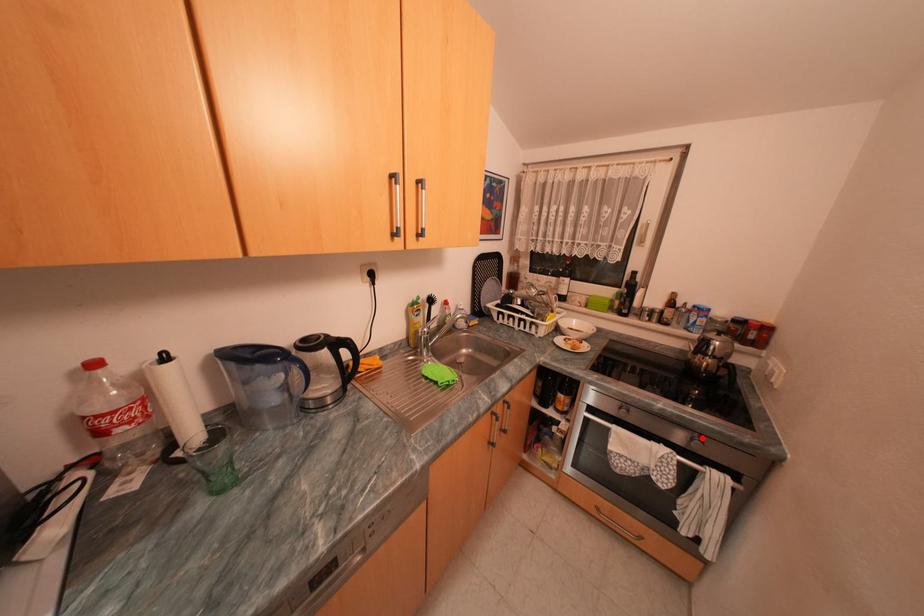
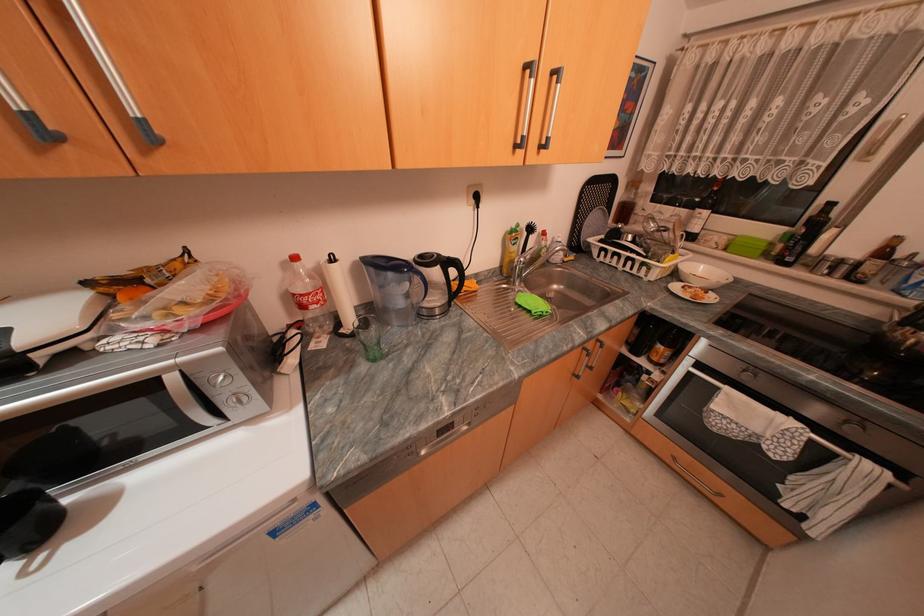
Question: I am providing you with two images of the same scene from different viewpoints. Image1 has a red point marked. In image2, the corresponding 3D location appears at what relative position? Reply with the corresponding letter.

Choices:
 (A) Closer
 (B) Farther

Answer: (B)